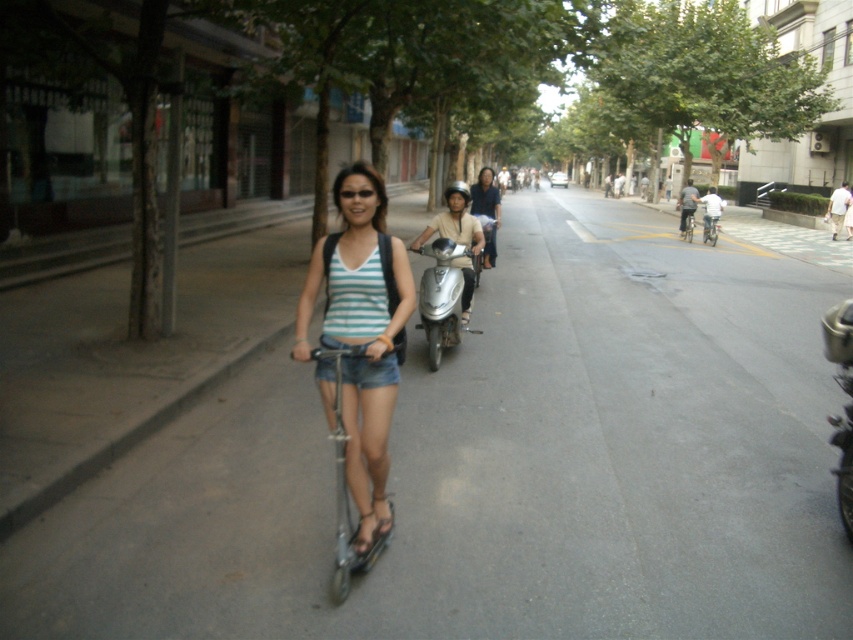
You are a delivery person who needs to cross the gray asphalt road at center to reach the sidewalk where the silver metallic bicycle at center is parked. Is the bicycle in front of or behind the road?

The gray asphalt road at center is in front of the silver metallic bicycle at center, so the bicycle is behind the road.